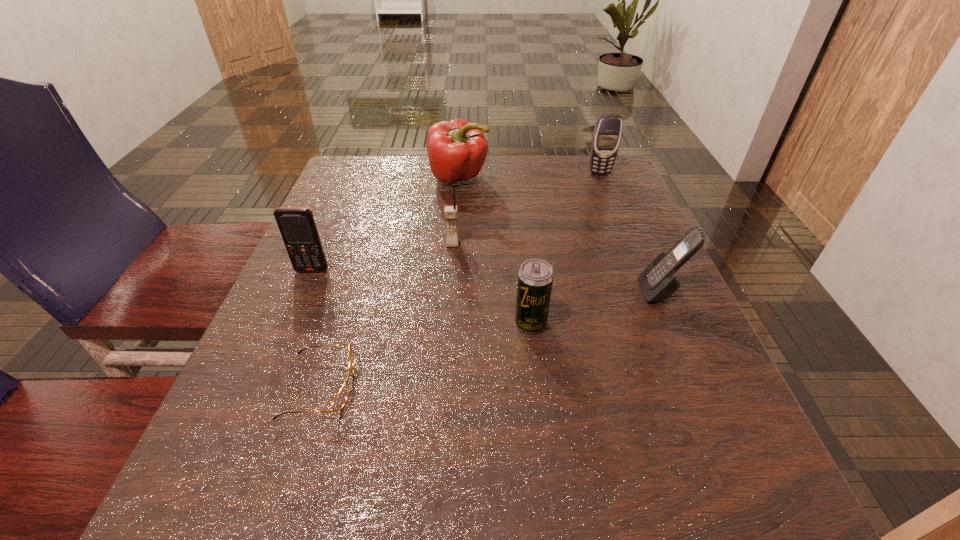
Identify the location of the farthest cellular telephone. The height and width of the screenshot is (540, 960). (607, 133).

The image size is (960, 540). What are the coordinates of `bell pepper` in the screenshot? It's located at (457, 149).

Find the location of a particular element. the leftmost object is located at coordinates (297, 226).

I want to click on the third farthest cellular telephone, so click(297, 226).

Find the location of a particular element. Image resolution: width=960 pixels, height=540 pixels. the second farthest cellular telephone is located at coordinates (450, 212).

Image resolution: width=960 pixels, height=540 pixels. I want to click on the fifth nearest object, so click(x=450, y=212).

The height and width of the screenshot is (540, 960). What are the coordinates of `the nearest cellular telephone` in the screenshot? It's located at (658, 281).

At what (x,y) coordinates should I click in order to perform the action: click on the second nearest object. Please return your answer as a coordinate pair (x, y). Looking at the image, I should click on (535, 277).

You are a GUI agent. You are given a task and a screenshot of the screen. Output one action in this format:
    pyautogui.click(x=<x>, y=<y>)
    Task: Click on the fifth object from left to right
    The width and height of the screenshot is (960, 540).
    Given the screenshot: What is the action you would take?
    pyautogui.click(x=535, y=277)

I want to click on the nearest object, so pos(340,399).